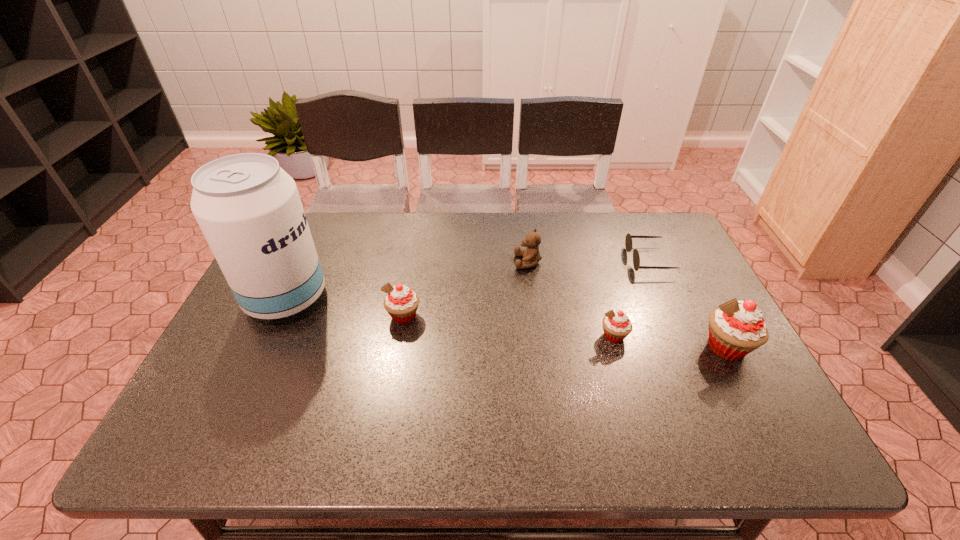
The width and height of the screenshot is (960, 540). In order to click on vacant space that is in between the leftmost cupcake and the teddy bear in this screenshot , I will do `click(466, 289)`.

Image resolution: width=960 pixels, height=540 pixels. I want to click on object that is the second nearest to the shortest cupcake, so click(628, 241).

Identify which object is located as the third nearest to the fifth object from right to left. Please provide its 2D coordinates. Your answer should be formatted as a tuple, i.e. [(x, y)], where the tuple contains the x and y coordinates of a point satisfying the conditions above.

[(617, 326)]

I want to click on cupcake that stands as the closest to the alcohol, so click(401, 303).

Find the location of a particular element. This screenshot has height=540, width=960. cupcake that stands as the closest to the second tallest cupcake is located at coordinates (617, 326).

Locate an element on the screen. free space that satisfies the following two spatial constraints: 1. on the front side of the tallest object; 2. on the right side of the second tallest object is located at coordinates (263, 347).

This screenshot has width=960, height=540. Identify the location of vacant space that satisfies the following two spatial constraints: 1. on the front-facing side of the third object from left to right; 2. on the right side of the tallest cupcake. (539, 347).

Locate an element on the screen. The width and height of the screenshot is (960, 540). vacant space that satisfies the following two spatial constraints: 1. on the front side of the fourth object from left to right; 2. on the right side of the leftmost cupcake is located at coordinates (400, 336).